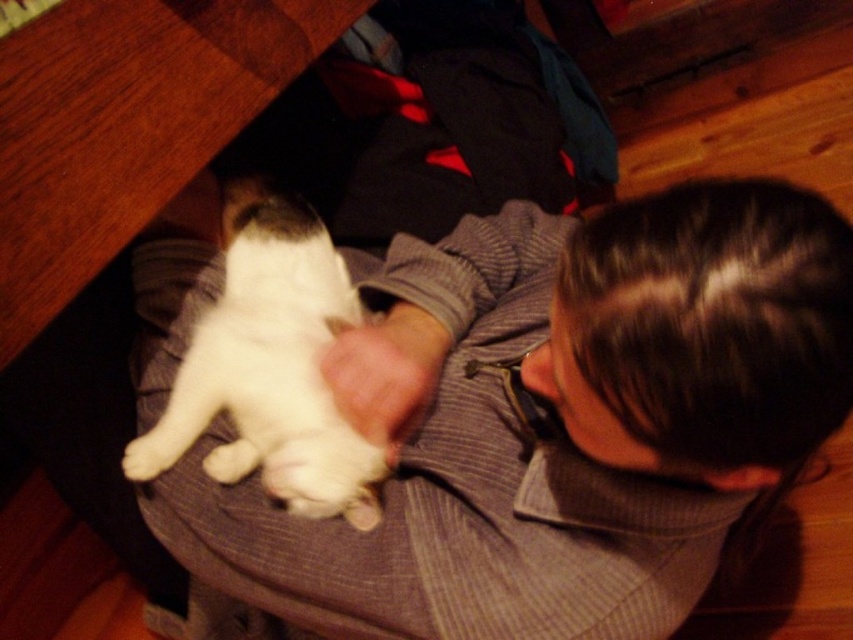
Question: Which point appears closest to the camera in this image?

Choices:
 (A) (187, 396)
 (B) (556, 364)

Answer: (B)

Question: Does striped sweater at center lie in front of white fur cat at center?

Choices:
 (A) yes
 (B) no

Answer: (A)

Question: Does striped sweater at center have a smaller size compared to white fur cat at center?

Choices:
 (A) no
 (B) yes

Answer: (A)

Question: Can you confirm if striped sweater at center is positioned above white fur cat at center?

Choices:
 (A) yes
 (B) no

Answer: (B)

Question: Among these points, which one is farthest from the camera?

Choices:
 (A) (308, 408)
 (B) (177, 243)

Answer: (B)